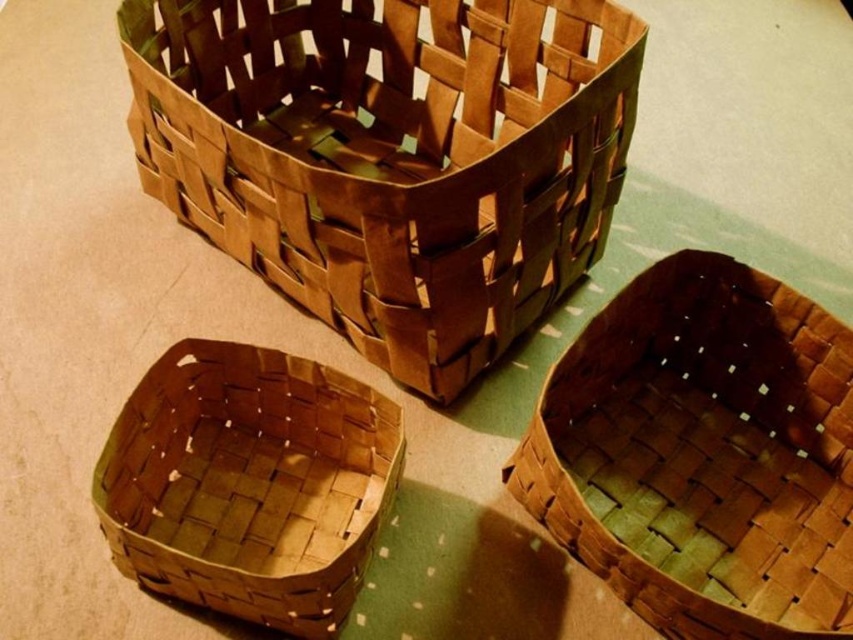
You are standing in front of the three woven baskets arranged on the table. You notice two specific points marked on the baskets. The first point is at coordinate point [254,177] and the second is at point [607,376]. If you were to draw a straight line between these two points, would the line pass in front of or behind the baskets?

The line between point [254,177] and point [607,376] would pass in front of the baskets because point [254,177] is in front of point [607,376].

You are organizing items on a table and need to place a new item between the brown woven basket at upper center and another object. However, there are no other objects mentioned in the scene. Please revise the question to include all objects from the Objects list.

The brown woven basket at upper center is located at point (392, 157). However, since there are only three baskets in the scene, the question should mention all objects listed in the Objects section.